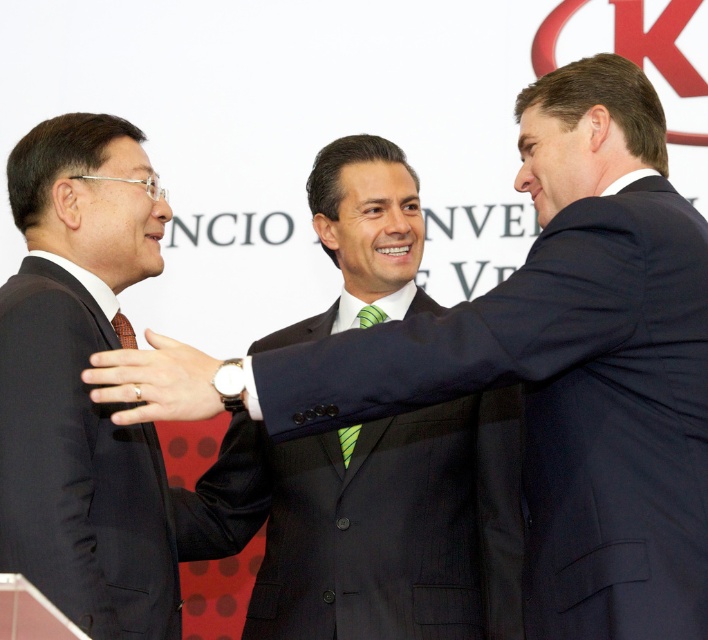
What do you see at coordinates (348, 442) in the screenshot? I see `greenmaterial/texturetie at center` at bounding box center [348, 442].

Can you confirm if greenmaterial/texturetie at center is smaller than green textured tie at center?

Actually, greenmaterial/texturetie at center might be larger than green textured tie at center.

Is point (348, 449) closer to viewer compared to point (113, 326)?

No, it is behind (113, 326).

Image resolution: width=708 pixels, height=640 pixels. I want to click on greenmaterial/texturetie at center, so click(x=348, y=442).

Does black matte suit at left have a larger size compared to greenmaterial/texturetie at center?

Correct, black matte suit at left is larger in size than greenmaterial/texturetie at center.

Identify the location of black matte suit at left. Image resolution: width=708 pixels, height=640 pixels. (81, 384).

This screenshot has height=640, width=708. What do you see at coordinates (81, 384) in the screenshot? I see `black matte suit at left` at bounding box center [81, 384].

Where is `black matte suit at left`? The image size is (708, 640). black matte suit at left is located at coordinates (81, 384).

Does gold metallic ring at center lie in front of green textured tie at center?

Yes.

Between point (149, 332) and point (122, 344), which one is positioned in front?

Point (149, 332) is more forward.

Which is behind, point (130, 381) or point (118, 321)?

Positioned behind is point (118, 321).

Where is `gold metallic ring at center`? The height and width of the screenshot is (640, 708). gold metallic ring at center is located at coordinates (154, 381).